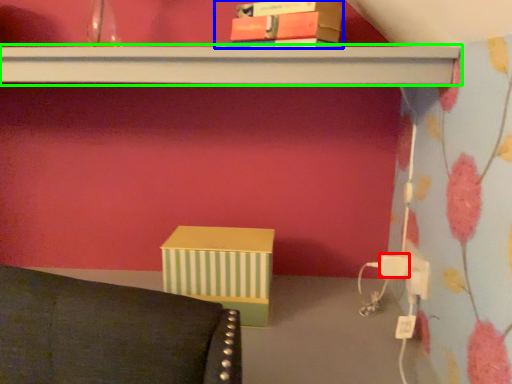
Question: Based on their relative distances, which object is farther from plug (highlighted by a red box)? Choose from book (highlighted by a blue box) and shelf (highlighted by a green box).

Choices:
 (A) book
 (B) shelf

Answer: (A)